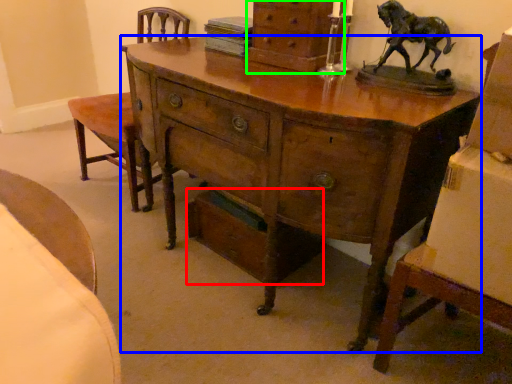
Question: Based on their relative distances, which object is nearer to drawer (highlighted by a red box)? Choose from desk (highlighted by a blue box) and chest of drawers (highlighted by a green box).

Choices:
 (A) desk
 (B) chest of drawers

Answer: (A)